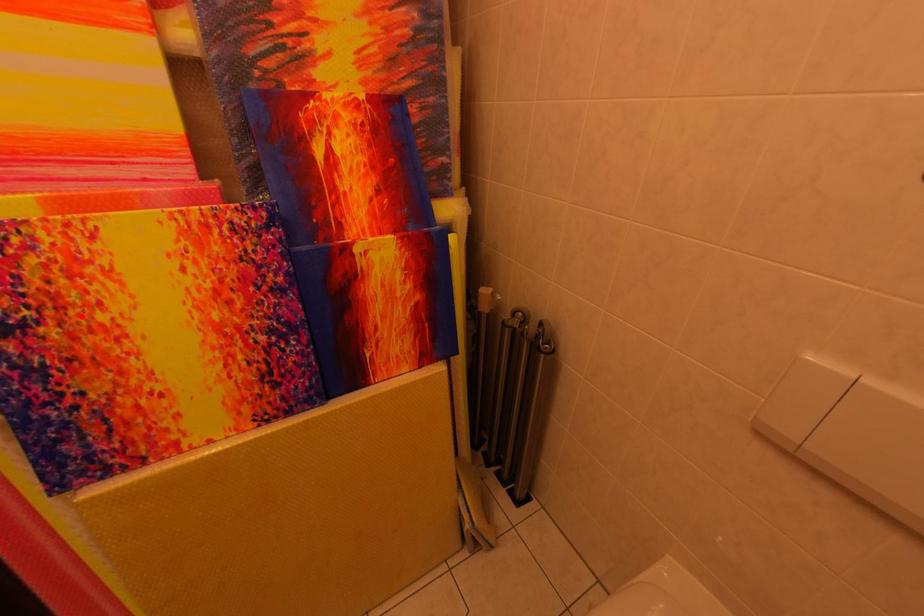
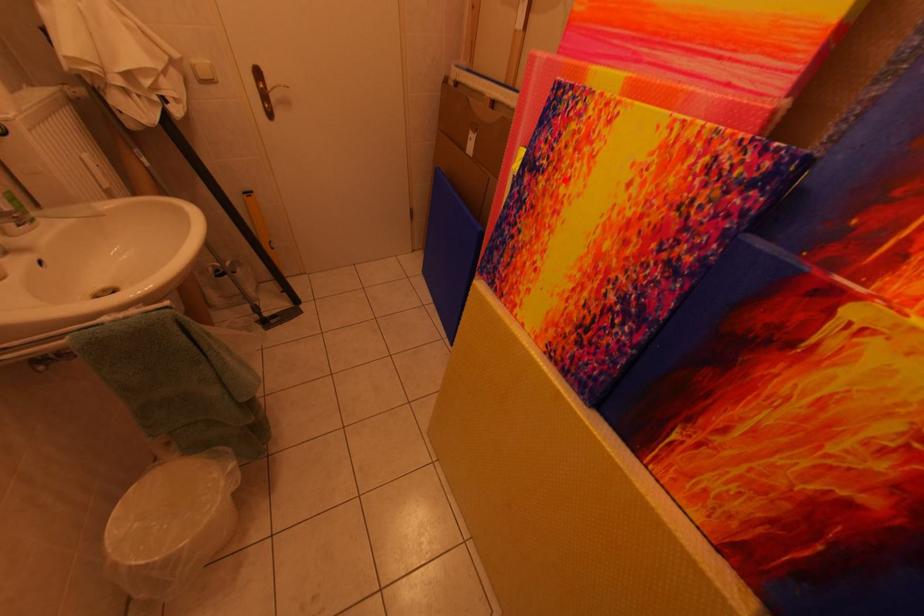
I am providing you with two images of the same scene from different viewpoints. A red point is marked on the first image and another point is marked on the second image. Do the highlighted points in image1 and image2 indicate the same real-world spot?

Yes